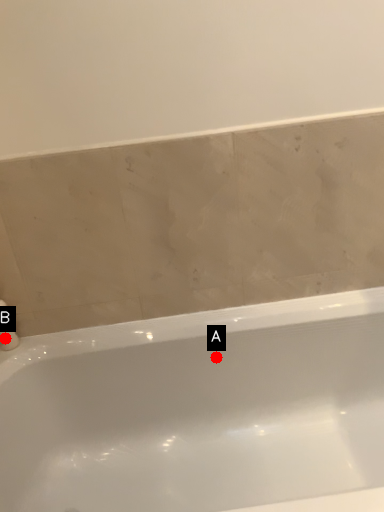
Question: Two points are circled on the image, labeled by A and B beside each circle. Which point is closer to the camera taking this photo?

Choices:
 (A) A is closer
 (B) B is closer

Answer: (B)